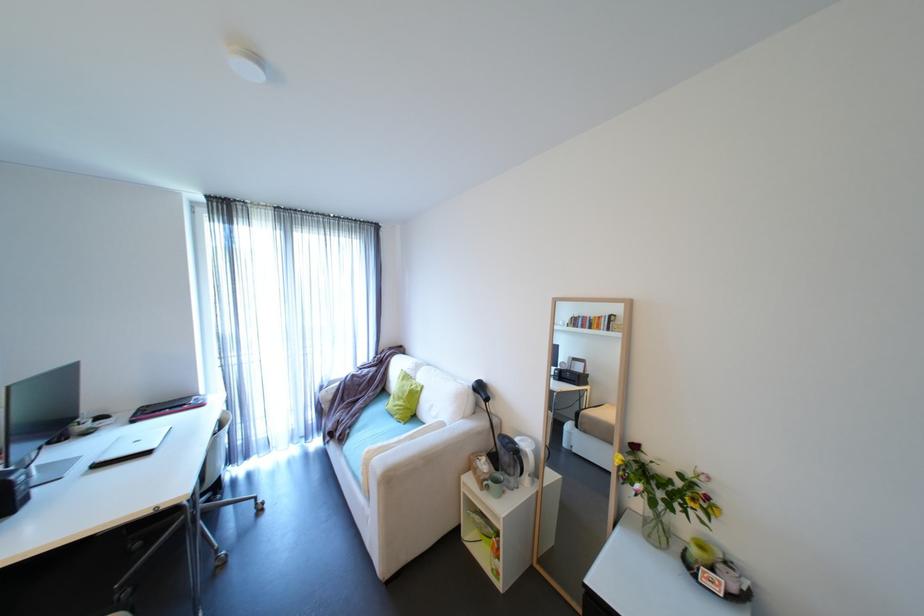
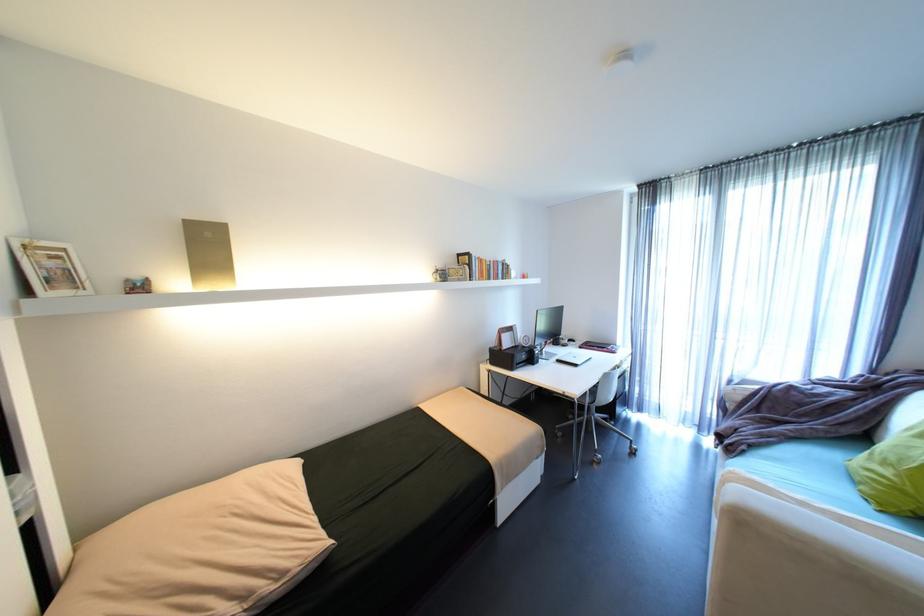
Question: The images are taken continuously from a first-person perspective. In which direction is your viewpoint rotating?

Choices:
 (A) Left
 (B) Right
 (C) Up
 (D) Down

Answer: (A)